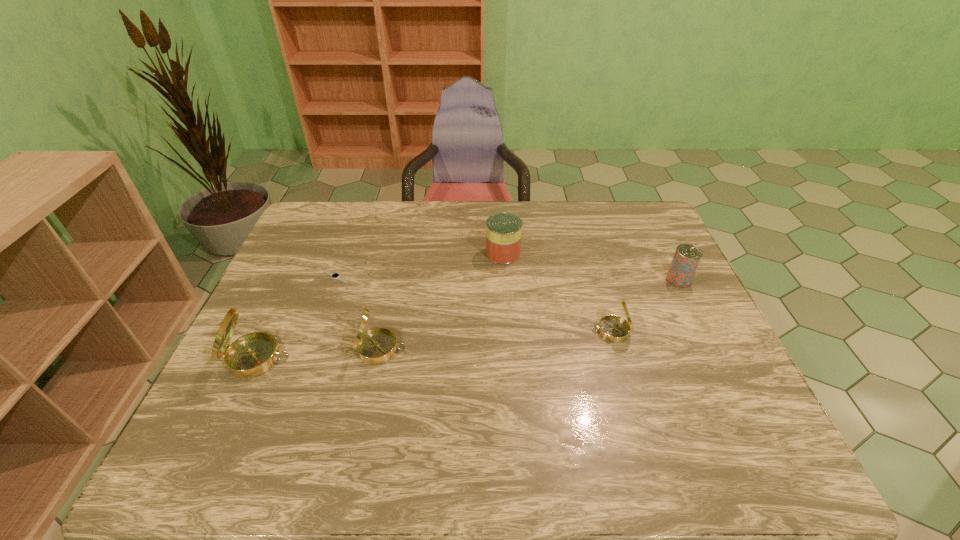
This screenshot has width=960, height=540. What are the coordinates of `free space between the second tallest compass and the rightmost compass` in the screenshot? It's located at (495, 340).

Locate an element on the screen. free spot between the tallest object and the shortest compass is located at coordinates (434, 345).

Where is `vacant point located between the shortest object and the leftmost object`? vacant point located between the shortest object and the leftmost object is located at coordinates [x=297, y=318].

Image resolution: width=960 pixels, height=540 pixels. Find the location of `free spot between the tallest compass and the second object from right to left`. free spot between the tallest compass and the second object from right to left is located at coordinates (434, 345).

Identify the location of vacant space in between the beer can and the second shortest compass. Image resolution: width=960 pixels, height=540 pixels. (529, 314).

The height and width of the screenshot is (540, 960). In order to click on free space between the second compass from right to left and the beer can in this screenshot , I will do `click(529, 314)`.

You are a GUI agent. You are given a task and a screenshot of the screen. Output one action in this format:
    pyautogui.click(x=<x>, y=<y>)
    Task: Click on the free space between the watch and the leftmost compass
    
    Given the screenshot: What is the action you would take?
    pyautogui.click(x=297, y=318)

Find the location of a particular element. The width and height of the screenshot is (960, 540). empty space that is in between the shortest compass and the rightmost object is located at coordinates (645, 305).

This screenshot has height=540, width=960. I want to click on object that can be found as the third closest to the leftmost compass, so click(503, 230).

Choose which object is the third nearest neighbor to the second shortest compass. Please provide its 2D coordinates. Your answer should be formatted as a tuple, i.e. [(x, y)], where the tuple contains the x and y coordinates of a point satisfying the conditions above.

[(503, 230)]